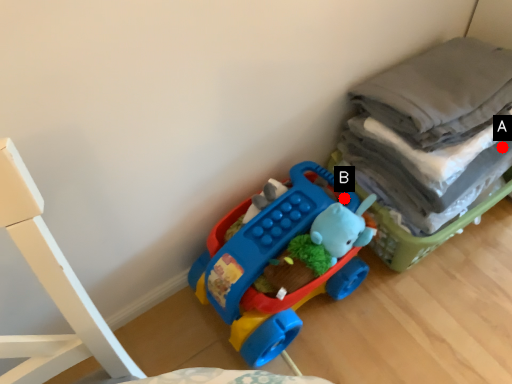
Question: Two points are circled on the image, labeled by A and B beside each circle. Which point is further to the camera?

Choices:
 (A) A is further
 (B) B is further

Answer: (A)